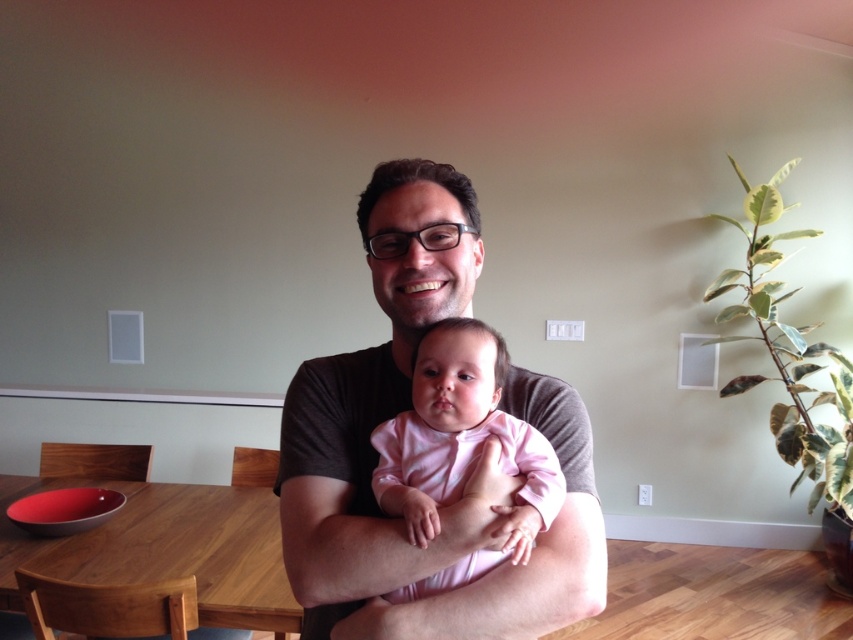
You are a photographer standing at the camera position. You want to adjust your position so that the distance between you and the matte black shirt at center becomes 40 inches. Which direction should you move?

The current distance between the matte black shirt at center and the camera is 34.09 inches. To increase the distance to 40 inches, you should move backward away from the matte black shirt at center.

You are standing in the dining area and want to place a small decoration between the two points, point (248, 518) and point (416, 401). Which point should you place it closer to in order for it to appear closer to the camera?

You should place the decoration closer to point (248, 518) because it is already further to the camera than point (416, 401). This will make the decoration appear closer to the camera.

You are a photographer setting up for a family photo. You need to place a small decorative item on the wooden table at lower left and the pink matte onesie at center. Since you want the item on the table to be larger in the photo than the onesie, which object should you choose for the table?

The wooden table at lower left has a larger width than the pink matte onesie at center, so placing the item on the wooden table at lower left will make it appear larger in the photo compared to the pink matte onesie at center.